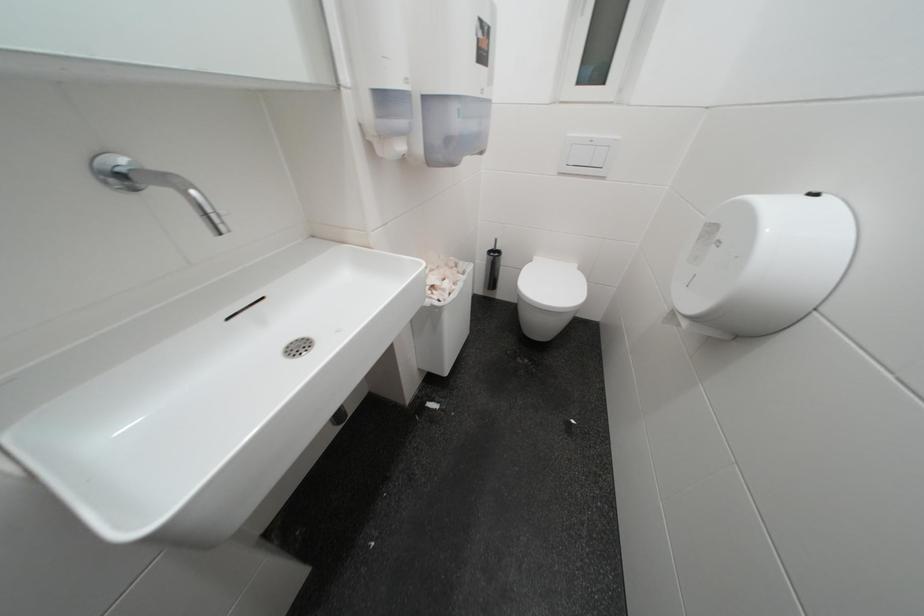
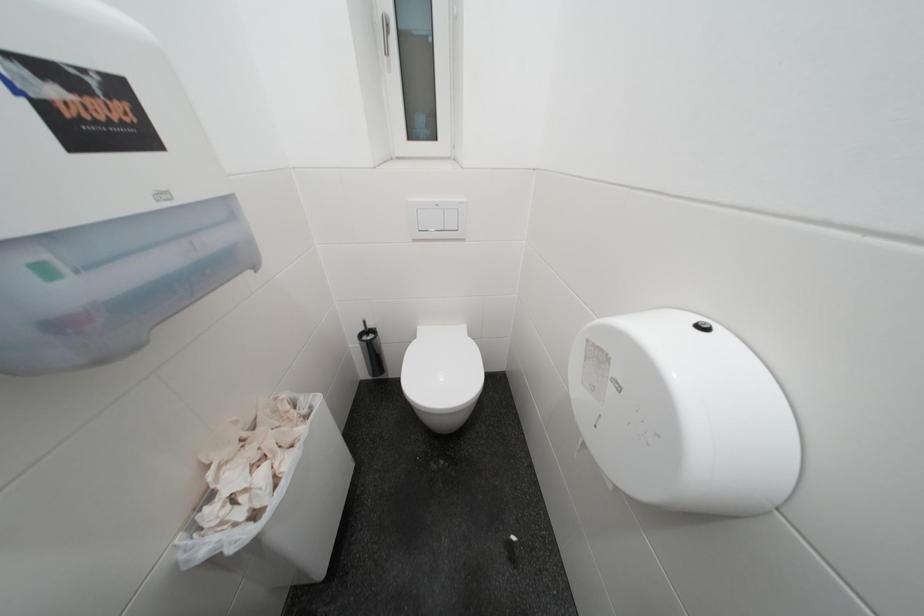
Question: The camera is either moving clockwise (left) or counter-clockwise (right) around the object. The first image is from the beginning of the video and the second image is from the end. Is the camera moving left or right when shooting the video?

Choices:
 (A) Left
 (B) Right

Answer: (A)